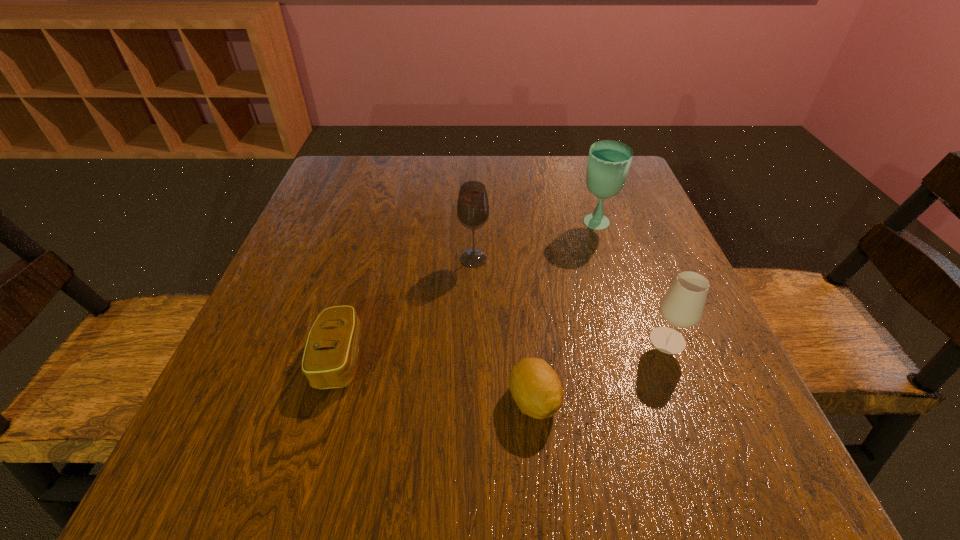
This screenshot has width=960, height=540. Identify the location of vacant region located at the stem end of the third object from left to right. (543, 498).

Find the location of a particular element. The image size is (960, 540). blank area located on the zipper side of the clutch bag is located at coordinates (525, 358).

I want to click on object present at the left edge, so click(330, 356).

The image size is (960, 540). In the image, there is a desktop. Find the location of `vacant region at the far edge`. vacant region at the far edge is located at coordinates (413, 201).

You are a GUI agent. You are given a task and a screenshot of the screen. Output one action in this format:
    pyautogui.click(x=<x>, y=<y>)
    Task: Click on the free space at the near edge of the desktop
    The height and width of the screenshot is (540, 960).
    Given the screenshot: What is the action you would take?
    pyautogui.click(x=563, y=449)

In the image, there is a desktop. Identify the location of vacant region at the left edge. The height and width of the screenshot is (540, 960). (294, 373).

In the image, there is a desktop. In order to click on free region at the right edge in this screenshot , I will do `click(693, 399)`.

The width and height of the screenshot is (960, 540). I want to click on free space at the far left corner of the desktop, so click(x=365, y=157).

I want to click on vacant point at the near left corner, so click(207, 466).

Locate an element on the screen. Image resolution: width=960 pixels, height=540 pixels. free space at the far right corner of the desktop is located at coordinates (632, 187).